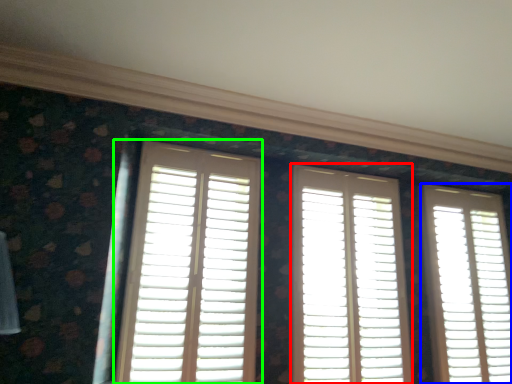
Question: Based on their relative distances, which object is farther from window (highlighted by a red box)? Choose from window (highlighted by a blue box) and window (highlighted by a green box).

Choices:
 (A) window
 (B) window

Answer: (B)